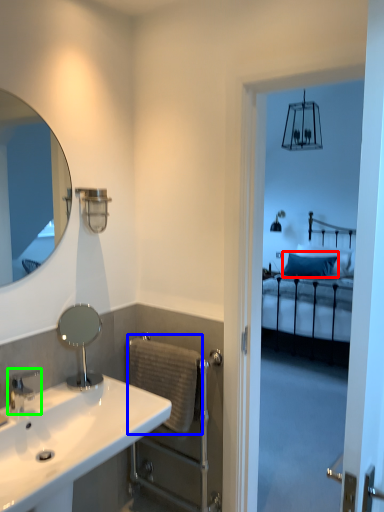
Question: Which is nearer to the pillow (highlighted by a red box)? towel bar (highlighted by a blue box) or tap (highlighted by a green box).

Choices:
 (A) towel bar
 (B) tap

Answer: (A)